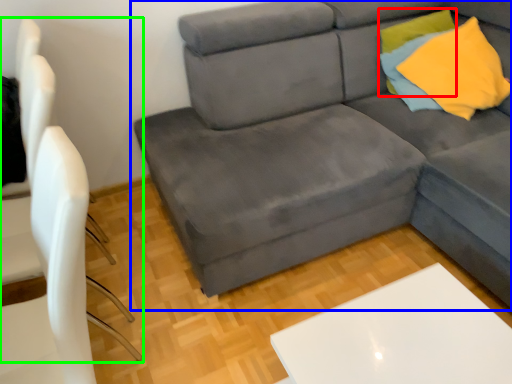
Question: Considering the real-world distances, which object is closest to pillow (highlighted by a red box)? studio couch (highlighted by a blue box) or armchair (highlighted by a green box).

Choices:
 (A) studio couch
 (B) armchair

Answer: (A)